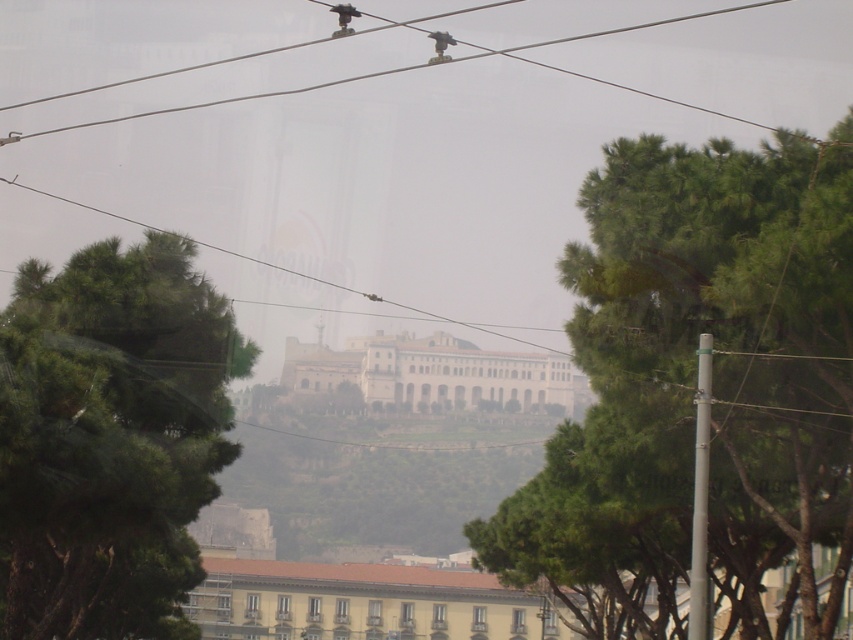
Looking at this image, you are a drone operator trying to capture the white stone building at center from above. Given that the building is at coordinates point 0.586, 0.511, can you confirm if it is positioned centrally within the image frame?

The white stone building at center is located at point (434, 374), which indicates it is positioned centrally within the image frame.

You are a photographer aiming to capture the historic building without any obstructions. You notice the green leafy tree at center and the clear wire at center in your viewfinder. Which object should you adjust your camera angle to avoid?

The green leafy tree at center is positioned under the clear wire at center. To avoid obstructions, adjust your camera angle to exclude the green leafy tree at center which is blocking the view of the historic building.

You are standing in front of the historic building and want to take a photo that includes both the point at coordinates [199,317] and the point at [224,556]. Since you want the closer point to be in focus, which point should you focus on?

You should focus on point [199,317] because it is closer to the camera than point [224,556].